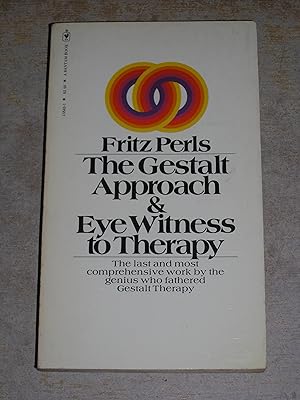
The height and width of the screenshot is (400, 300). In order to click on white countertop in this screenshot , I will do `click(283, 275)`.